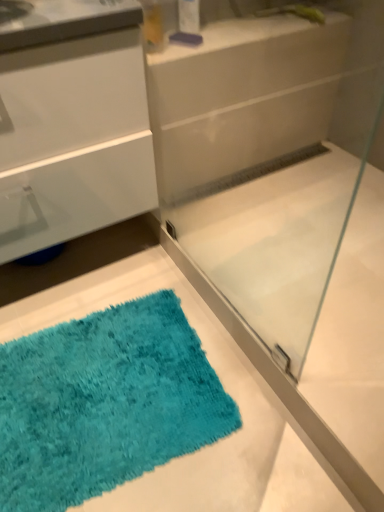
Where is `vacant point above turquoise shaggy bath mat at lower left (from a real-world perspective)`? vacant point above turquoise shaggy bath mat at lower left (from a real-world perspective) is located at coordinates (103, 384).